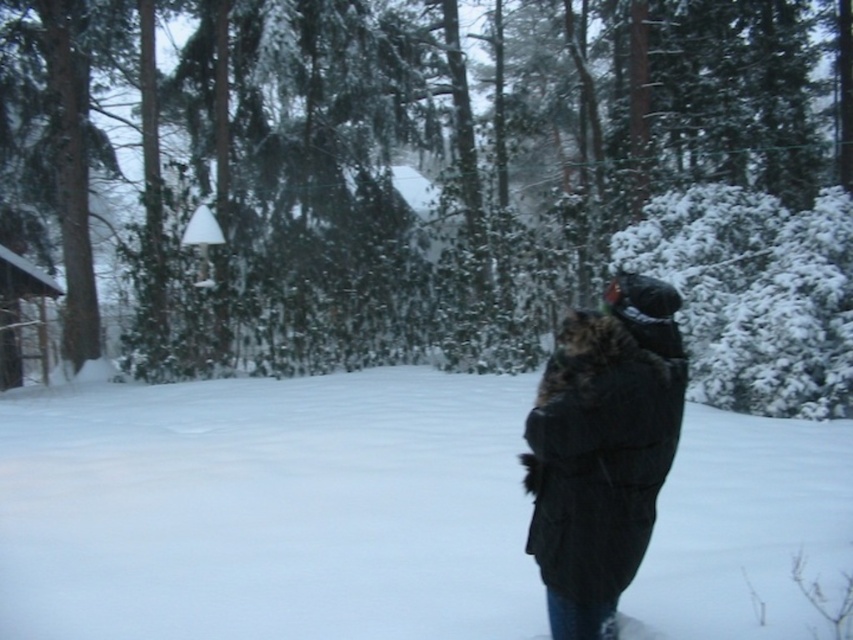
Can you confirm if snow-covered evergreen tree at center is positioned to the left of dark fur coat at center?

Correct, you'll find snow-covered evergreen tree at center to the left of dark fur coat at center.

Who is shorter, snow-covered evergreen tree at center or dark fur coat at center?

dark fur coat at center

Find the location of `snow-covered evergreen tree at center`. snow-covered evergreen tree at center is located at coordinates (396, 164).

Based on the photo, is dark fur coat at center above wooden cabin at left?

No.

In order to click on dark fur coat at center in this screenshot , I will do `click(602, 449)`.

Is white fluffy snow at center smaller than dark fur coat at center?

No, white fluffy snow at center is not smaller than dark fur coat at center.

Who is positioned more to the right, white fluffy snow at center or dark fur coat at center?

dark fur coat at center is more to the right.

Locate an element on the screen. white fluffy snow at center is located at coordinates (268, 508).